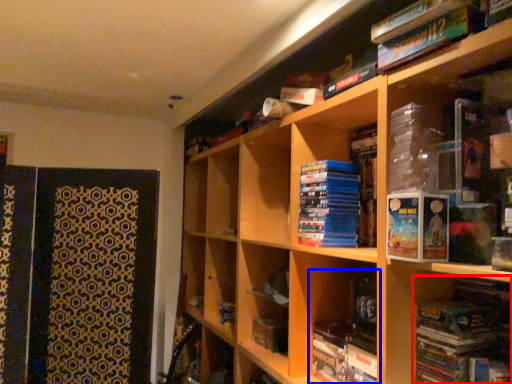
Question: Which of the following is the farthest to the observer, book (highlighted by a red box) or book (highlighted by a blue box)?

Choices:
 (A) book
 (B) book

Answer: (B)